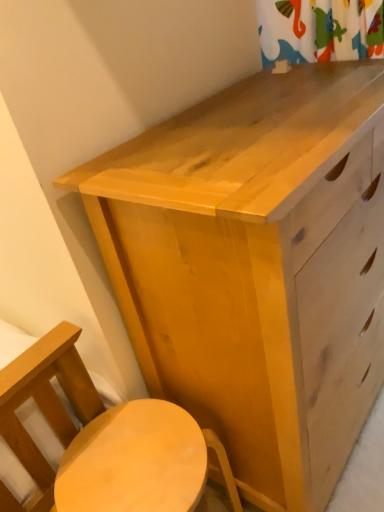
Describe the element at coordinates (134, 461) in the screenshot. The image size is (384, 512). I see `light brown wooden table at lower left` at that location.

Where is `light brown wooden table at lower left`? This screenshot has width=384, height=512. light brown wooden table at lower left is located at coordinates (134, 461).

I want to click on light brown wooden table at lower left, so click(134, 461).